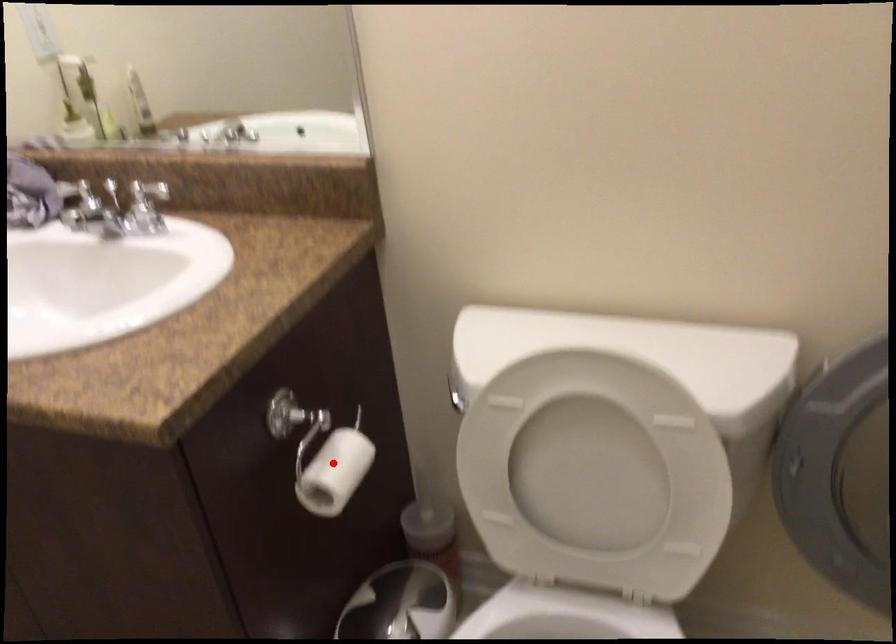
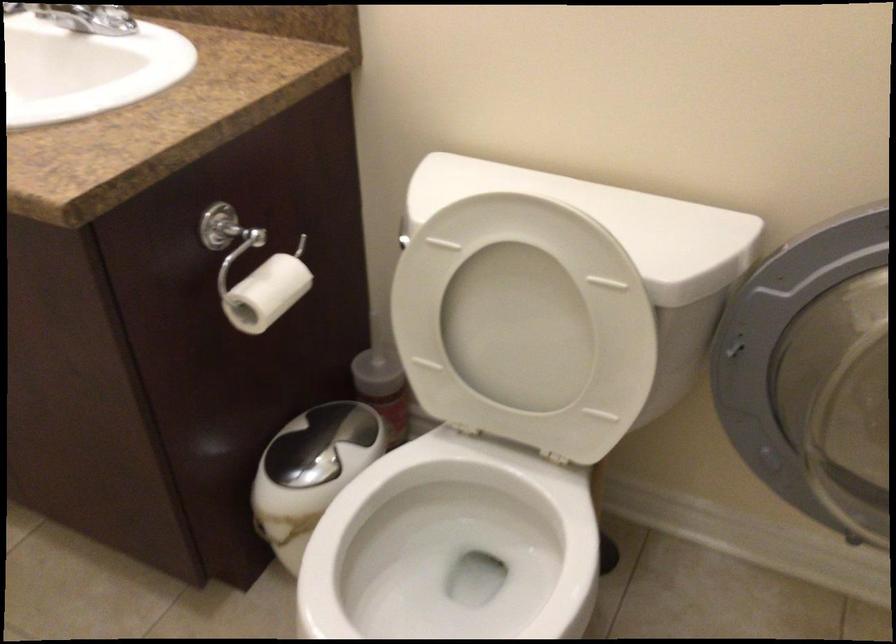
Where in the second image is the point corresponding to the highlighted location from the first image?

(263, 286)